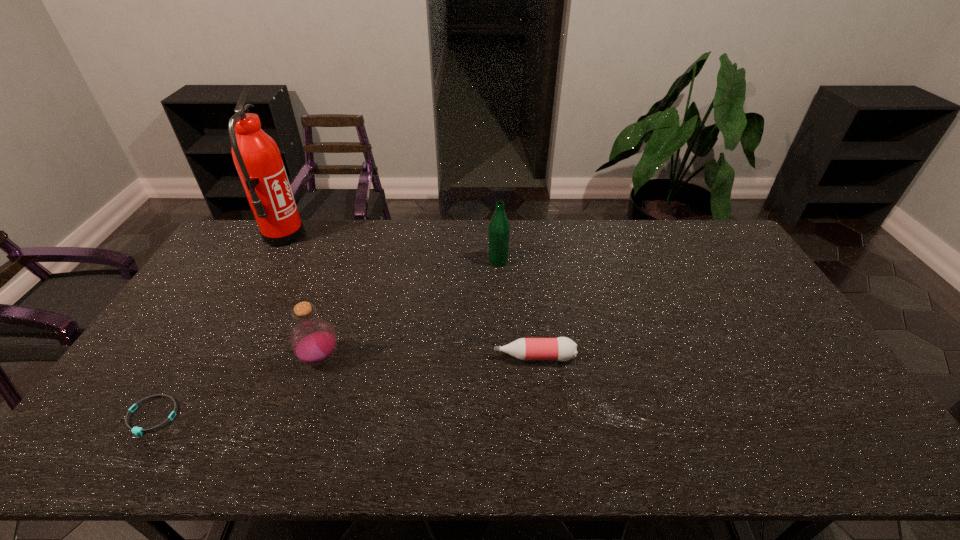
Find the location of a particular element. The image size is (960, 540). object located in the far left corner section of the desktop is located at coordinates pos(257,158).

This screenshot has width=960, height=540. What are the coordinates of `object located at the near left corner` in the screenshot? It's located at (135, 430).

I want to click on vacant space at the far edge, so click(311, 224).

Where is `vacant space at the near edge of the desktop`? vacant space at the near edge of the desktop is located at coordinates (184, 446).

At what (x,y) coordinates should I click in order to perform the action: click on free space at the left edge. Please return your answer as a coordinate pair (x, y). The width and height of the screenshot is (960, 540). Looking at the image, I should click on (239, 284).

In the image, there is a desktop. Where is `vacant space at the right edge`? The width and height of the screenshot is (960, 540). vacant space at the right edge is located at coordinates (776, 352).

Image resolution: width=960 pixels, height=540 pixels. I want to click on blank space at the far left corner of the desktop, so click(x=243, y=244).

Locate an element on the screen. This screenshot has width=960, height=540. free spot between the wristband and the third object from right to left is located at coordinates (236, 387).

This screenshot has height=540, width=960. Find the location of `empty location between the leftmost bottle and the fire extinguisher`. empty location between the leftmost bottle and the fire extinguisher is located at coordinates (301, 298).

Image resolution: width=960 pixels, height=540 pixels. Find the location of `vacant space that's between the second farthest object and the tallest object`. vacant space that's between the second farthest object and the tallest object is located at coordinates (391, 249).